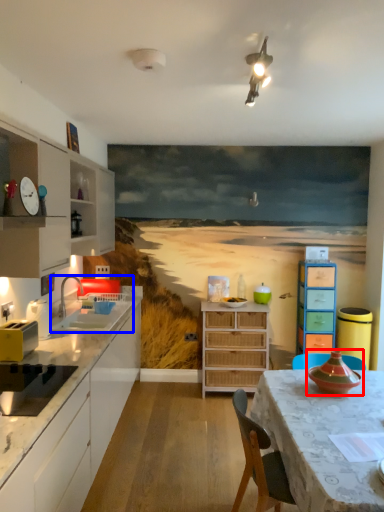
Question: Which point is closer to the camera, appliance (highlighted by a red box) or sink (highlighted by a blue box)?

Choices:
 (A) appliance
 (B) sink

Answer: (A)